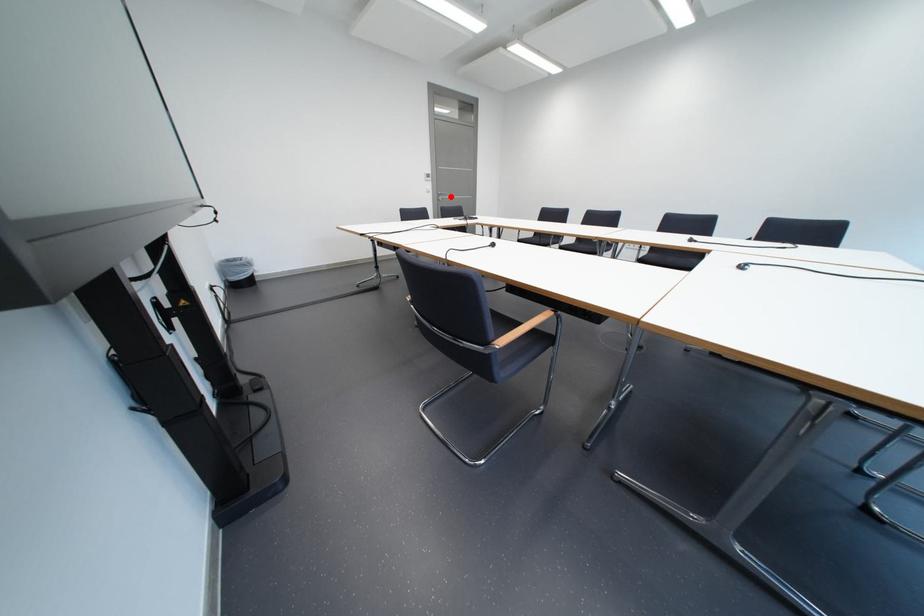
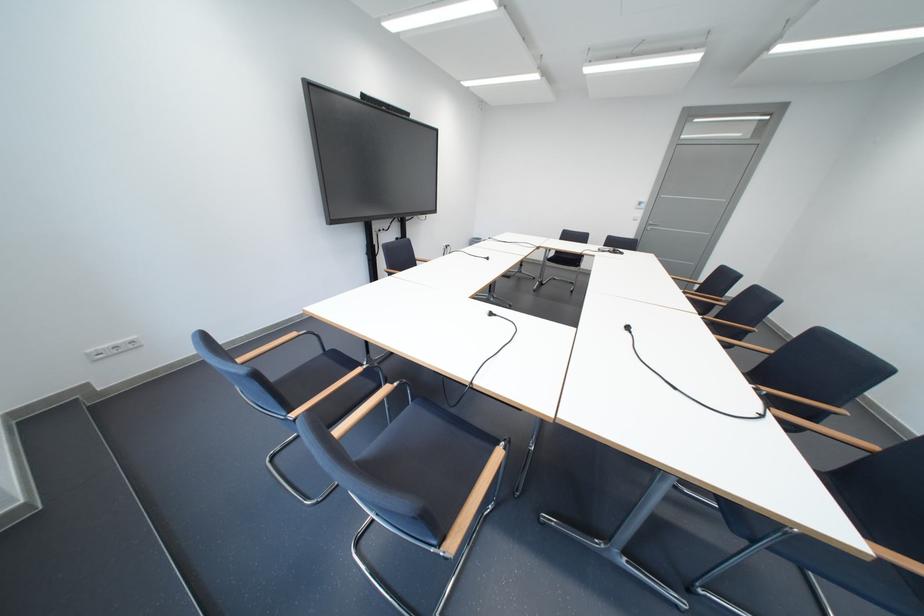
Question: I am providing you with two images of the same scene from different viewpoints. A red point is shown in image1. For the corresponding object point in image2, is it positioned nearer or farther from the camera?

Choices:
 (A) Nearer
 (B) Farther

Answer: (B)